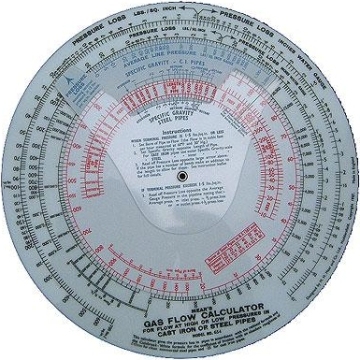
Find the location of a particular element. The width and height of the screenshot is (360, 360). plastic cover is located at coordinates (109, 134), (239, 165).